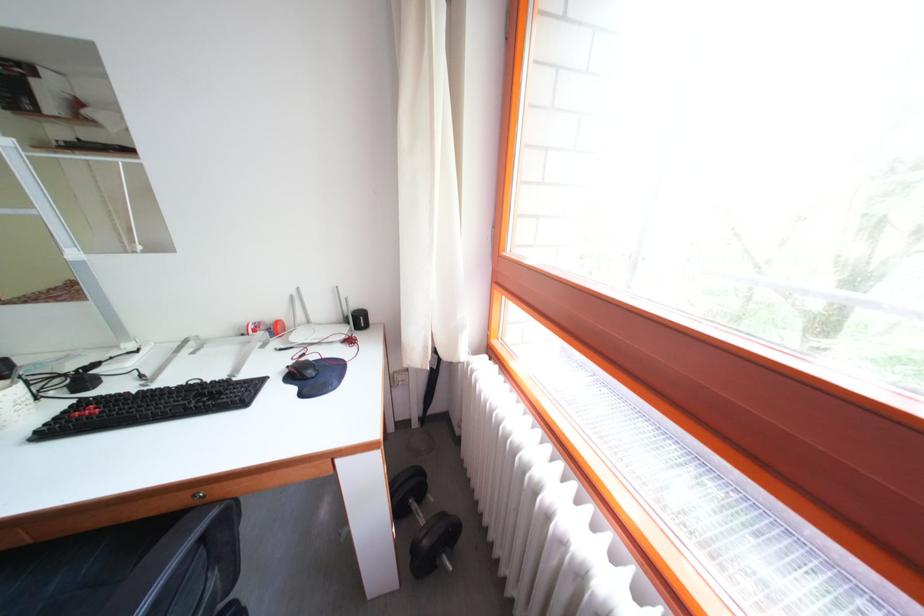
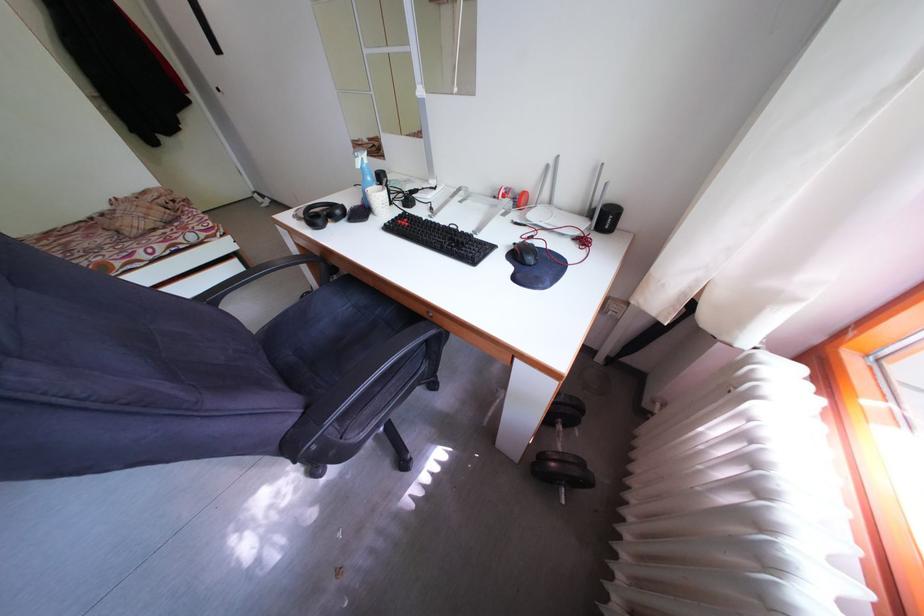
Find the pixel in the second image that matches pixel 300 302 in the first image.

(555, 172)